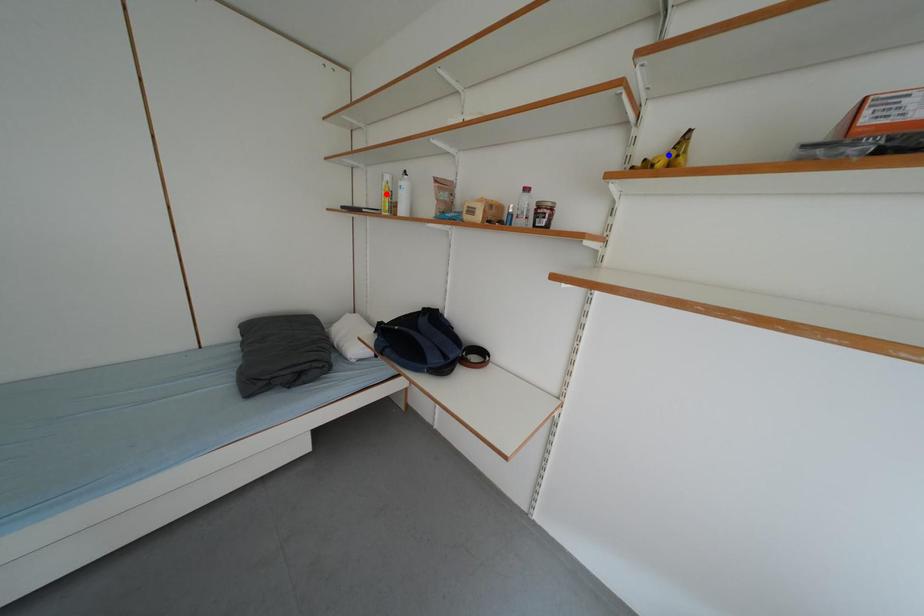
Question: Which of the two points in the image is closer to the camera?

Choices:
 (A) Blue point is closer.
 (B) Red point is closer.

Answer: (A)